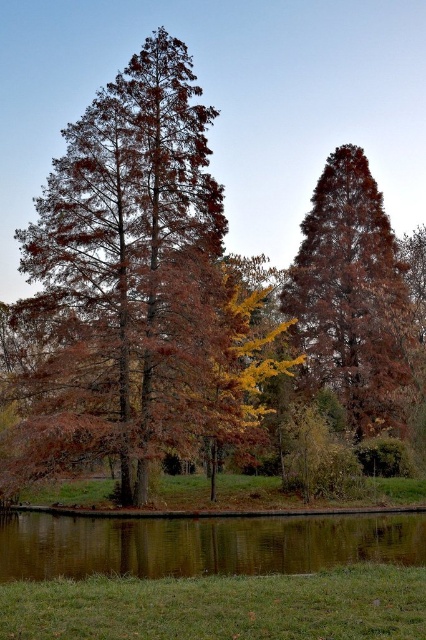
Can you confirm if matte brown tree at center is wider than green reflective water at bottom?

In fact, matte brown tree at center might be narrower than green reflective water at bottom.

Who is more forward, (382, 320) or (5, 536)?

Point (5, 536) is more forward.

At what (x,y) coordinates should I click in order to perform the action: click on matte brown tree at center. Please return your answer as a coordinate pair (x, y). Looking at the image, I should click on (353, 296).